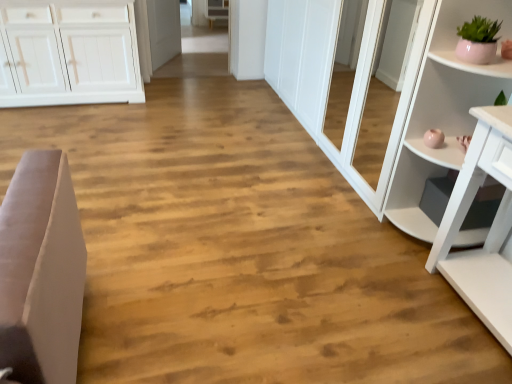
Find the location of a particular element. Image resolution: width=512 pixels, height=384 pixels. blank area to the left of white glossy shelf at right is located at coordinates (356, 236).